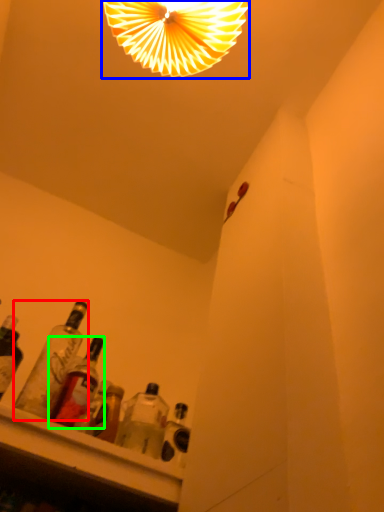
Question: Which object is the closest to the bottle (highlighted by a red box)? Choose among these: lamp (highlighted by a blue box) or bottle (highlighted by a green box).

Choices:
 (A) lamp
 (B) bottle

Answer: (B)